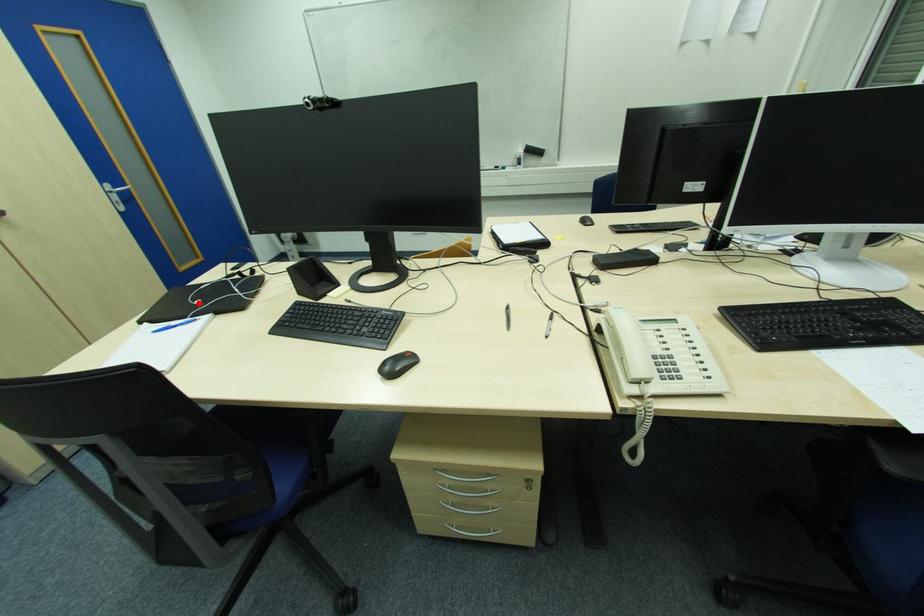
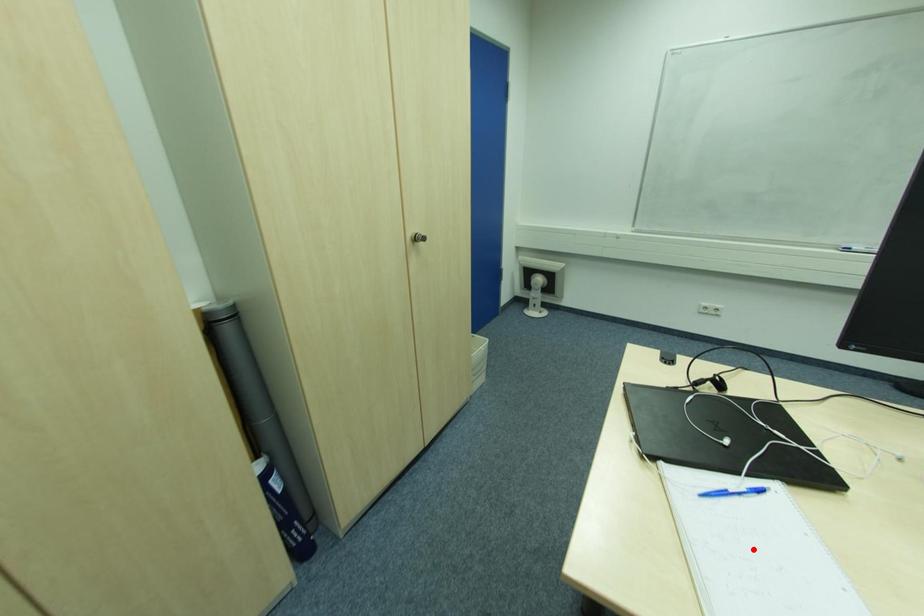
I am providing you with two images of the same scene from different viewpoints. A red point is marked on the first image and another point is marked on the second image. Are the points marked in image1 and image2 representing the same 3D position?

No